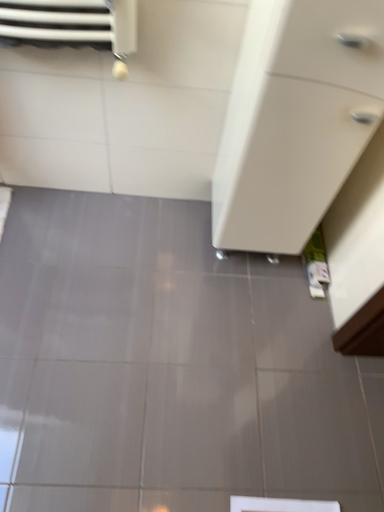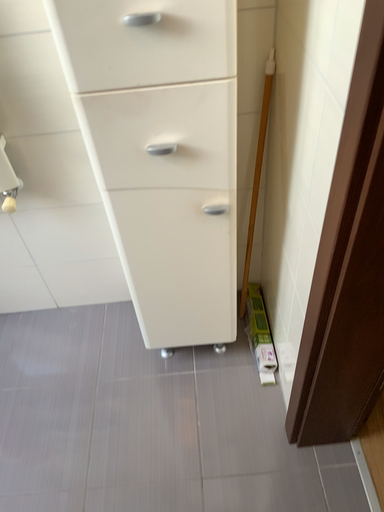
Question: Which way did the camera rotate in the video?

Choices:
 (A) rotated right
 (B) rotated left

Answer: (B)